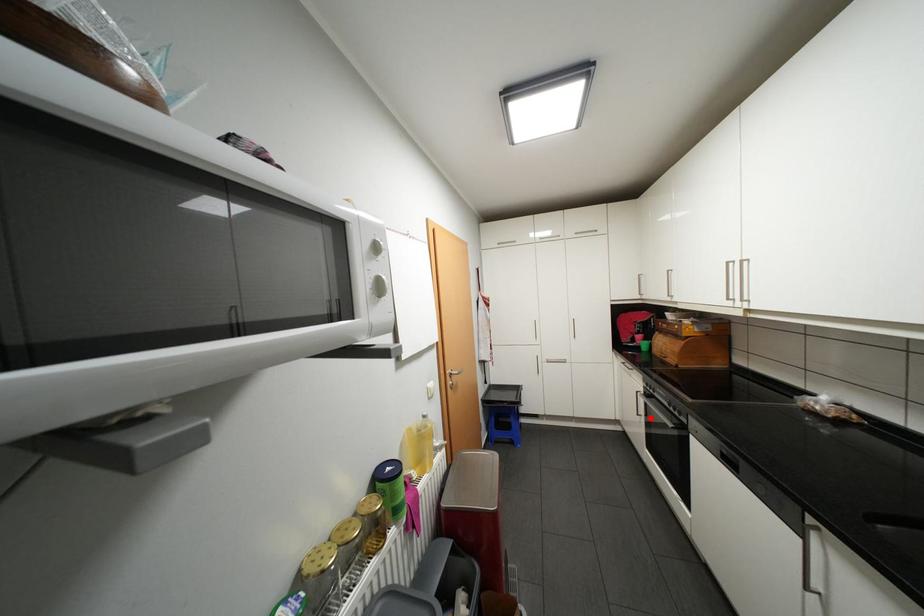
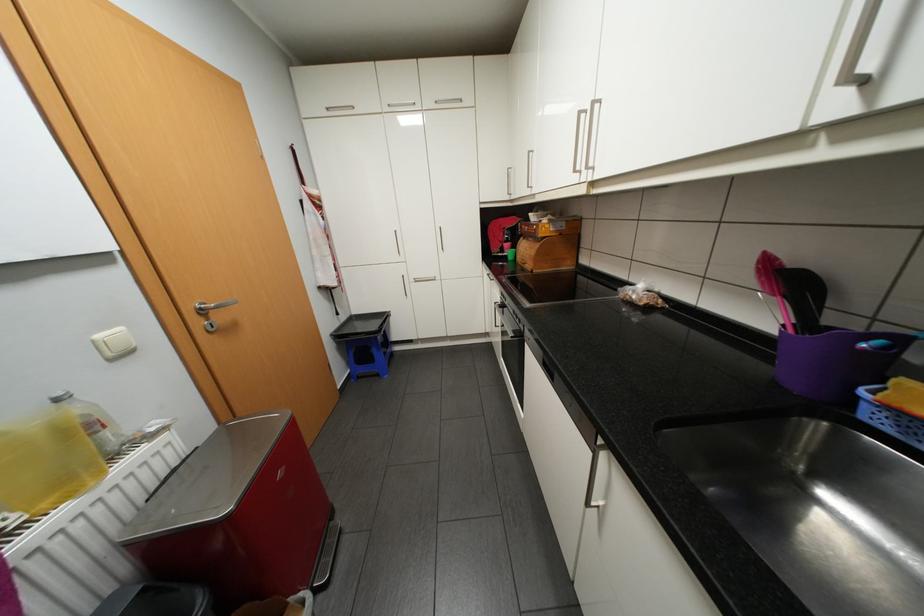
Where in the second image is the point corresponding to the highlighted location from the first image?

(506, 329)